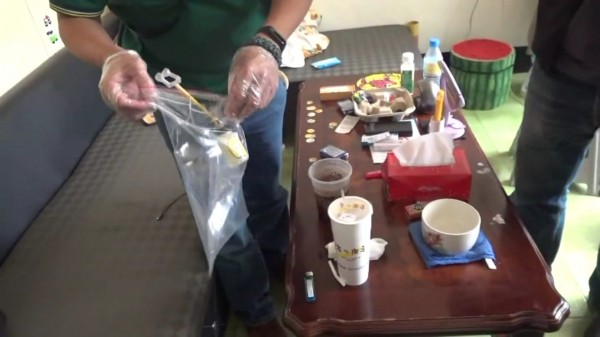
You are a GUI agent. You are given a task and a screenshot of the screen. Output one action in this format:
    pyautogui.click(x=<x>, y=<y>)
    Task: Click on the pale yellow plate
    Image resolution: width=600 pixels, height=337 pixels.
    Given the screenshot: What is the action you would take?
    pyautogui.click(x=378, y=81)